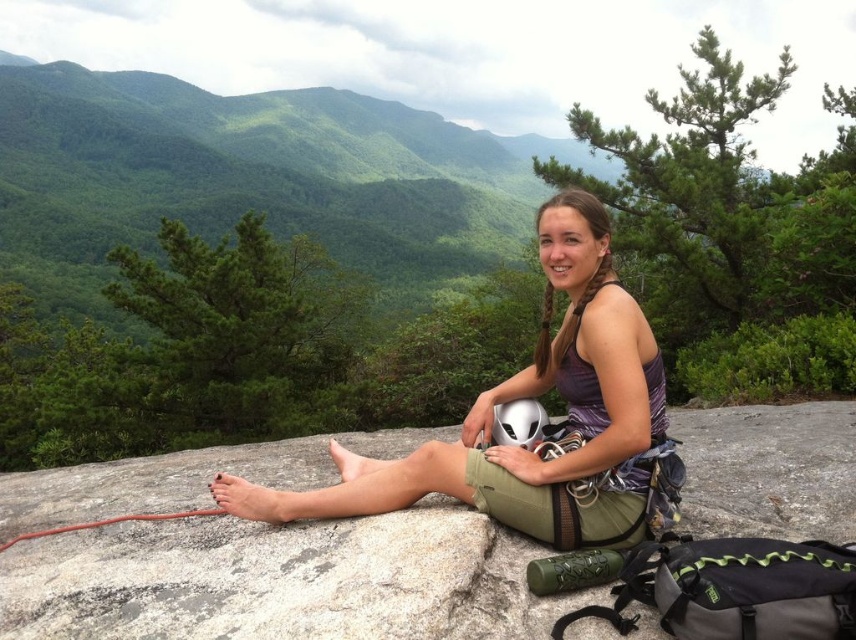
Question: Where is matte purple tank top at center located in relation to white matte helmet at center in the image?

Choices:
 (A) left
 (B) right

Answer: (A)

Question: Considering the real-world distances, which object is farthest from the white matte helmet at center?

Choices:
 (A) green fabric boulder at center
 (B) matte purple tank top at center

Answer: (A)

Question: Which object appears closest to the camera in this image?

Choices:
 (A) matte purple tank top at center
 (B) green fabric boulder at center

Answer: (B)

Question: Is matte purple tank top at center further to camera compared to white matte helmet at center?

Choices:
 (A) yes
 (B) no

Answer: (B)

Question: Is green fabric boulder at center positioned in front of matte purple tank top at center?

Choices:
 (A) no
 (B) yes

Answer: (B)

Question: Among these objects, which one is nearest to the camera?

Choices:
 (A) matte purple tank top at center
 (B) green fabric boulder at center

Answer: (B)